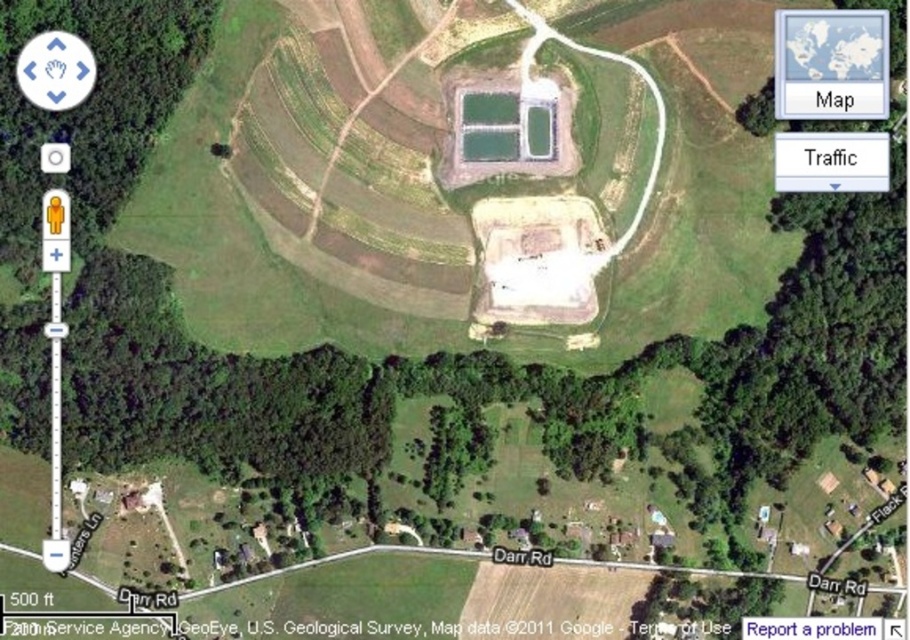
You are a delivery driver who needs to locate Darr Rd. on the map. The gray plastic map at upper right and the white text on blue button at bottom right are both visible. Which object should you focus on to find the road?

The gray plastic map at upper right has a lesser width compared to white text on blue button at bottom right. Since maps are typically larger for detail, the white text on blue button at bottom right is more likely to contain the road name Darr Rd. for easier reading.

You are looking at a map of a rural area and need to locate two elements. The gray plastic map at upper right shows the agricultural terraces, while the white text on blue button at bottom right indicates the road. Which of these two elements takes up more space on the map?

The gray plastic map at upper right is bigger than the white text on blue button at bottom right, so it takes up more space on the map.